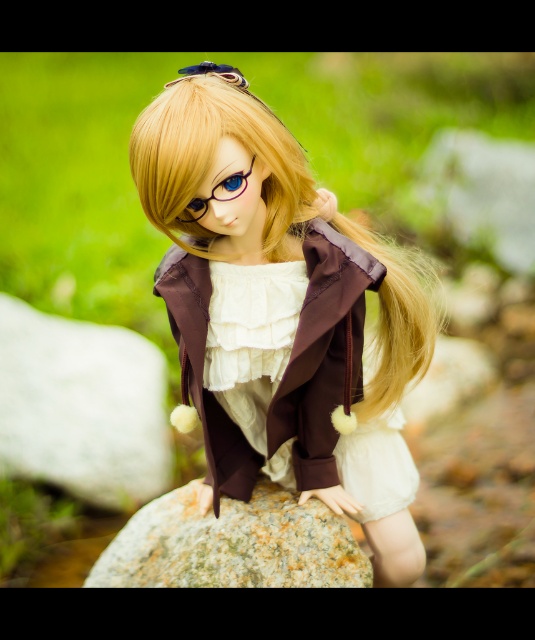
In the scene shown: You are a fashion designer observing a doll wearing a matte brown jacket at center and a white satin dress at center. Which piece of clothing is positioned to the right?

The matte brown jacket at center is positioned to the right of the white satin dress at center.

You are a photographer trying to capture the doll in the scene. The matte brown jacket at center and the green speckled rock at center are both in your frame. Which object will appear larger in your photo?

The matte brown jacket at center will appear larger in the photo because it is closer to the viewer than the green speckled rock at center.